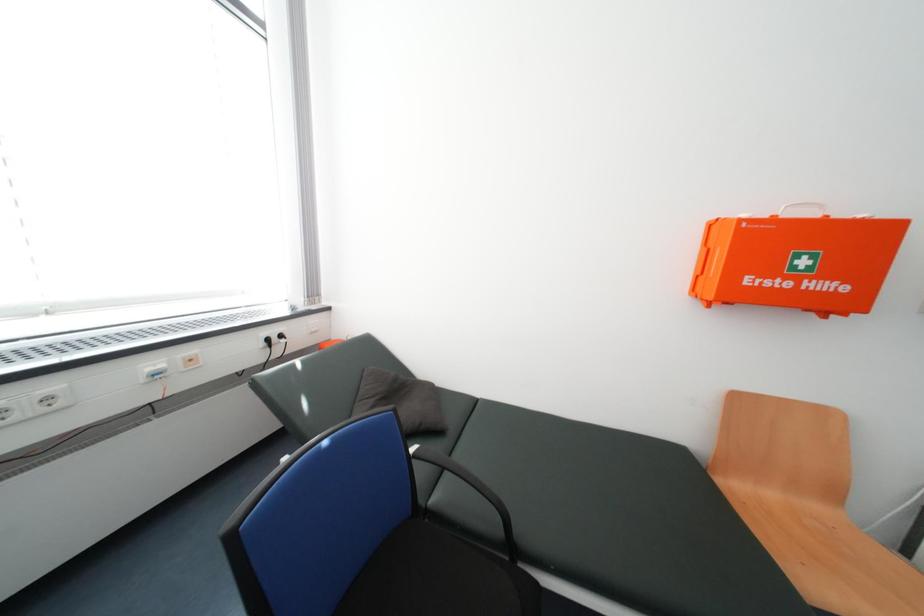
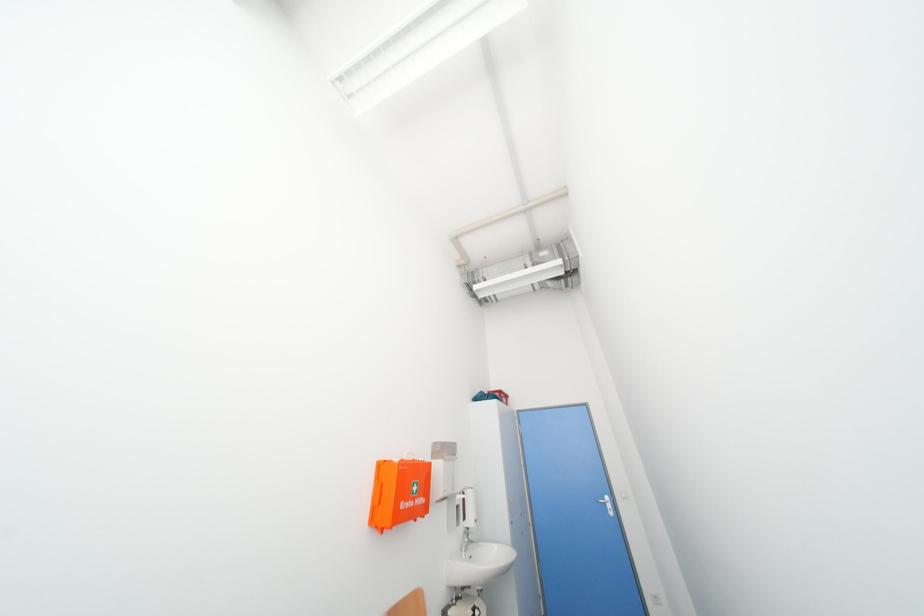
The images are taken continuously from a first-person perspective. In which direction is your viewpoint rotating?

The camera's rotation is toward right-up.